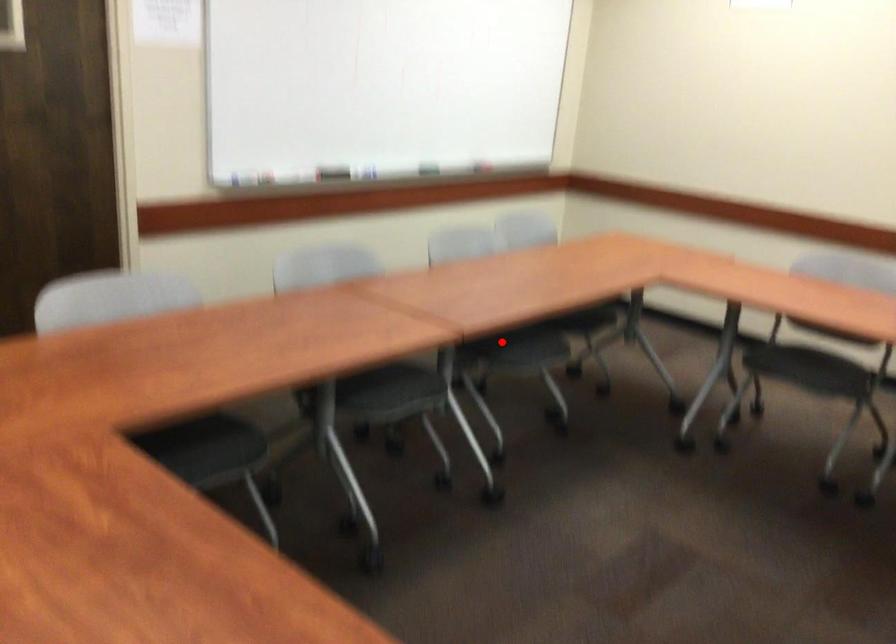
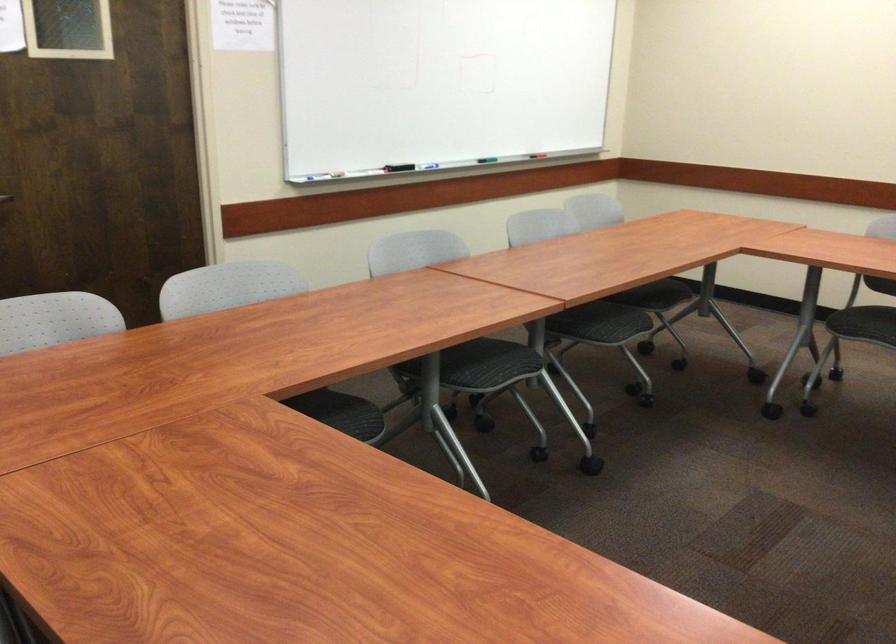
Where in the second image is the point corresponding to the highlighted location from the first image?

(583, 315)